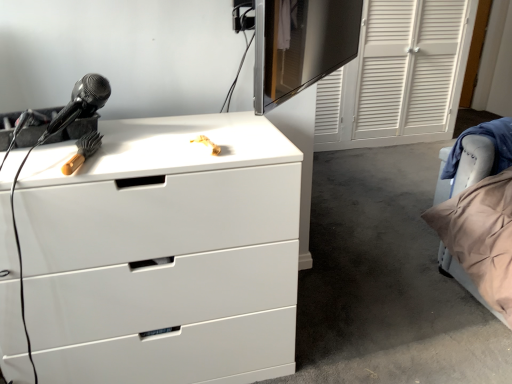
Question: Does point (487, 144) appear closer or farther from the camera than point (145, 208)?

Choices:
 (A) farther
 (B) closer

Answer: (A)

Question: In terms of width, does velvet beige pillow at right look wider or thinner when compared to white glossy chest of drawers at upper left?

Choices:
 (A) wide
 (B) thin

Answer: (B)

Question: Estimate the real-world distances between objects in this image. Which object is closer to the black glossy monitor at upper center?

Choices:
 (A) velvet beige pillow at right
 (B) white glossy chest of drawers at upper left

Answer: (A)

Question: Which object is positioned farthest from the velvet beige pillow at right?

Choices:
 (A) white glossy chest of drawers at upper left
 (B) black glossy monitor at upper center

Answer: (B)